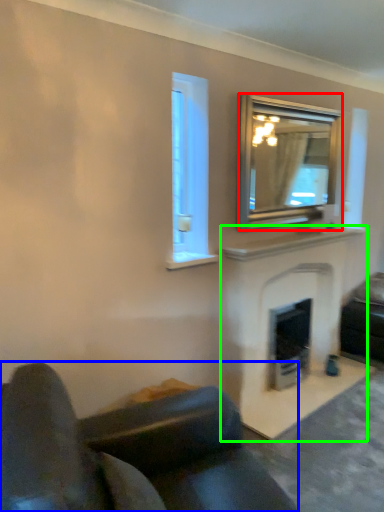
Question: Considering the real-world distances, which object is closest to mirror (highlighted by a red box)? studio couch (highlighted by a blue box) or fireplace (highlighted by a green box).

Choices:
 (A) studio couch
 (B) fireplace

Answer: (B)